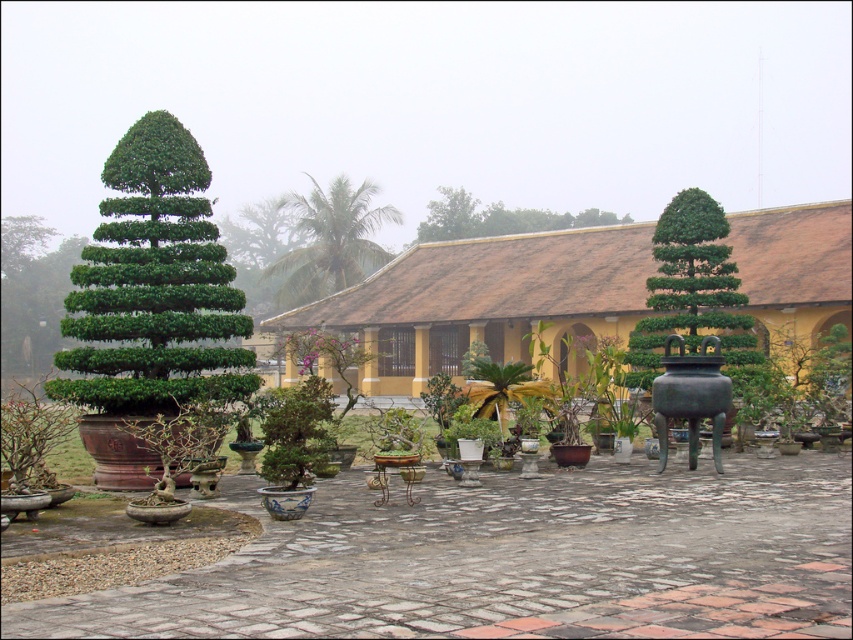
Question: Which object is positioned farthest from the green leafy palm at center?

Choices:
 (A) green leafy tree at left
 (B) green glossy bonsai at right
 (C) green leafy tree at upper center

Answer: (A)

Question: Which object appears farthest from the camera in this image?

Choices:
 (A) green leafy palm at center
 (B) green glossy bonsai at right

Answer: (A)

Question: Is green leafy tree at left wider than green leafy tree at upper center?

Choices:
 (A) yes
 (B) no

Answer: (B)

Question: Which object is positioned farthest from the green glossy bonsai at right?

Choices:
 (A) green leafy tree at upper center
 (B) green leafy palm at center
 (C) green leafy tree at left

Answer: (A)

Question: Is green leafy tree at left to the left of green leafy palm at center from the viewer's perspective?

Choices:
 (A) yes
 (B) no

Answer: (B)

Question: Is green leafy tree at left smaller than green glossy bonsai at right?

Choices:
 (A) no
 (B) yes

Answer: (B)